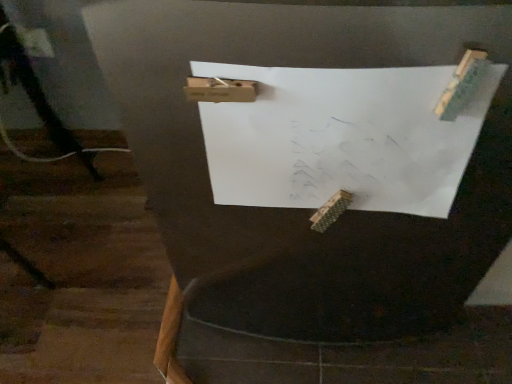
Measure the distance between white paper at center and camera.

They are 15.45 inches apart.

This screenshot has height=384, width=512. Describe the element at coordinates (342, 137) in the screenshot. I see `white paper at center` at that location.

Where is `white paper at center`? This screenshot has width=512, height=384. white paper at center is located at coordinates (342, 137).

What is the approximate width of black matte tripod at lower left?

The width of black matte tripod at lower left is 34.07 centimeters.

In order to face black matte tripod at lower left, should I rotate leftwards or rightwards?

To face it directly, rotate left by 34.415 degrees.

This screenshot has width=512, height=384. Describe the element at coordinates (36, 93) in the screenshot. I see `black matte tripod at lower left` at that location.

The width and height of the screenshot is (512, 384). In order to click on black matte tripod at lower left in this screenshot , I will do [x=36, y=93].

I want to click on white paper at center, so click(342, 137).

Which object is positioned more to the left, black matte tripod at lower left or white paper at center?

black matte tripod at lower left is more to the left.

Relative to white paper at center, is black matte tripod at lower left in front or behind?

black matte tripod at lower left is behind white paper at center.

Is point (30, 84) closer to camera compared to point (365, 160)?

No.

From the image's perspective, which one is positioned higher, black matte tripod at lower left or white paper at center?

black matte tripod at lower left, from the image's perspective.

From a real-world perspective, is black matte tripod at lower left located beneath white paper at center?

Yes, from a real-world perspective, black matte tripod at lower left is below white paper at center.

Can you confirm if black matte tripod at lower left is thinner than white paper at center?

No.

Which of these two, black matte tripod at lower left or white paper at center, stands taller?

black matte tripod at lower left is taller.

Considering the sizes of objects black matte tripod at lower left and white paper at center in the image provided, who is bigger, black matte tripod at lower left or white paper at center?

With larger size is black matte tripod at lower left.

Is black matte tripod at lower left outside of white paper at center?

Yes, black matte tripod at lower left is not within white paper at center.

Is the surface of black matte tripod at lower left in direct contact with white paper at center?

No, black matte tripod at lower left is not next to white paper at center.

Is black matte tripod at lower left looking in the opposite direction of white paper at center?

Yes, black matte tripod at lower left is facing away from white paper at center.

Identify the location of tripod on the left of white paper at center. This screenshot has width=512, height=384. (36, 93).

Is white paper at center at the right side of black matte tripod at lower left?

Correct, you'll find white paper at center to the right of black matte tripod at lower left.

Is the depth of white paper at center less than that of black matte tripod at lower left?

Yes, the depth of white paper at center is less than that of black matte tripod at lower left.

Considering the points (365, 203) and (5, 27), which point is in front, point (365, 203) or point (5, 27)?

Point (365, 203)

Consider the image. From the image's perspective, is white paper at center positioned above or below black matte tripod at lower left?

From the image's perspective, white paper at center appears below black matte tripod at lower left.

From a real-world perspective, who is located higher, white paper at center or black matte tripod at lower left?

white paper at center is physically above.

Considering the sizes of white paper at center and black matte tripod at lower left in the image, is white paper at center wider or thinner than black matte tripod at lower left?

white paper at center is thinner than black matte tripod at lower left.

Is white paper at center taller than black matte tripod at lower left?

No, white paper at center is not taller than black matte tripod at lower left.

Does white paper at center have a larger size compared to black matte tripod at lower left?

Incorrect, white paper at center is not larger than black matte tripod at lower left.

Would you say white paper at center is outside black matte tripod at lower left?

Indeed, white paper at center is completely outside black matte tripod at lower left.

From the picture: Is white paper at center positioned far away from black matte tripod at lower left?

No, white paper at center is not far from black matte tripod at lower left.

Is white paper at center facing away from black matte tripod at lower left?

No, white paper at center's orientation is not away from black matte tripod at lower left.

How many degrees apart are the facing directions of white paper at center and black matte tripod at lower left?

There is a 86.9-degree angle between the facing directions of white paper at center and black matte tripod at lower left.

Locate an element on the screen. tripod on the left of the white paper at center is located at coordinates (36, 93).

The width and height of the screenshot is (512, 384). There is a black matte tripod at lower left. What are the coordinates of `paper above it (from a real-world perspective)` in the screenshot? It's located at (342, 137).

Image resolution: width=512 pixels, height=384 pixels. In order to click on paper in front of the black matte tripod at lower left in this screenshot , I will do `click(342, 137)`.